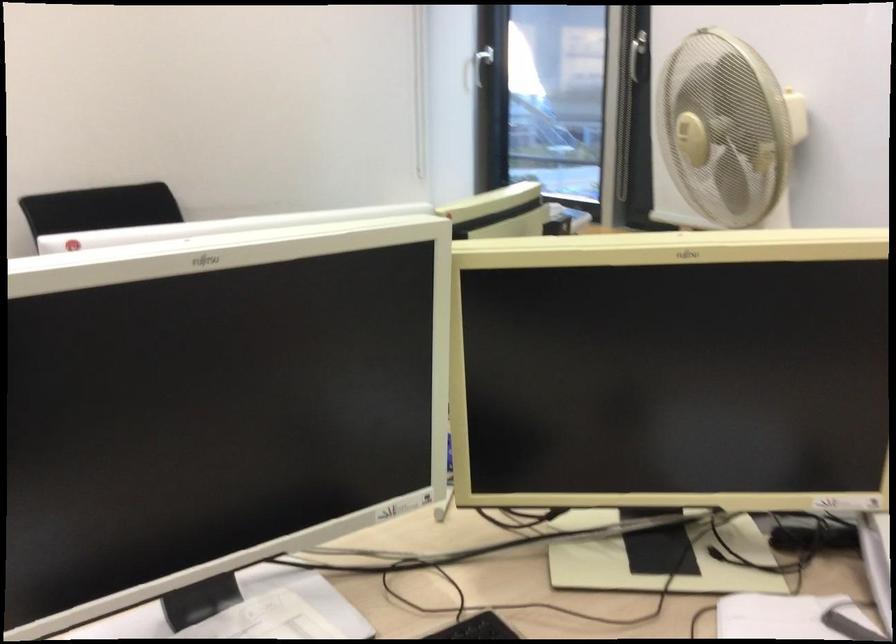
Image resolution: width=896 pixels, height=644 pixels. What do you see at coordinates (685, 129) in the screenshot? I see `the fan control knob` at bounding box center [685, 129].